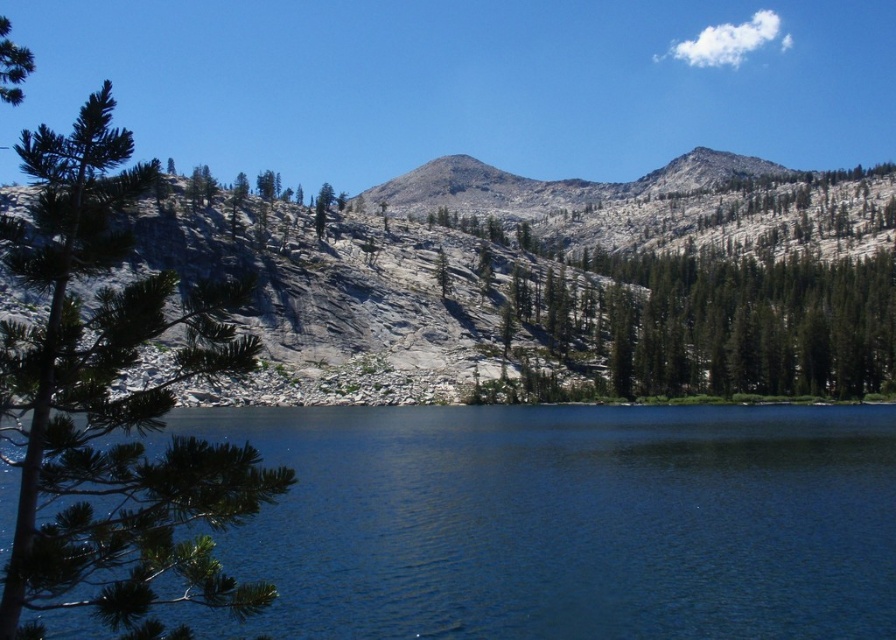
You are standing at the edge of the lake and want to place a small floating dock exactly at the center of the blue glassy water at center. According to the coordinates provided, where should you position the dock?

The blue glassy water at center is located at point [565,522], so you should position the dock at those coordinates to place it exactly at the center.

You are a photographer planning to capture the reflection of the blue glassy water at center in your shot. Given that the reflection point is at coordinates 0.817 on the x axis and 0.632 on the y axis, where would you position your camera to ensure the reflection is centered in the frame?

To center the reflection of the blue glassy water at center in the frame, position the camera directly above the reflection point at coordinates 0.817 on the x axis and 0.632 on the y axis, ensuring the lens is aligned perpendicular to the water surface.